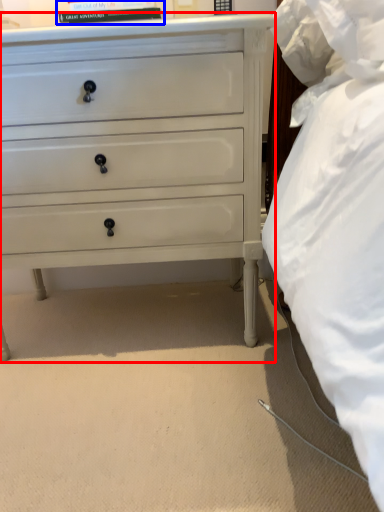
Question: Which object is closer to the camera taking this photo, chest of drawers (highlighted by a red box) or book (highlighted by a blue box)?

Choices:
 (A) chest of drawers
 (B) book

Answer: (A)